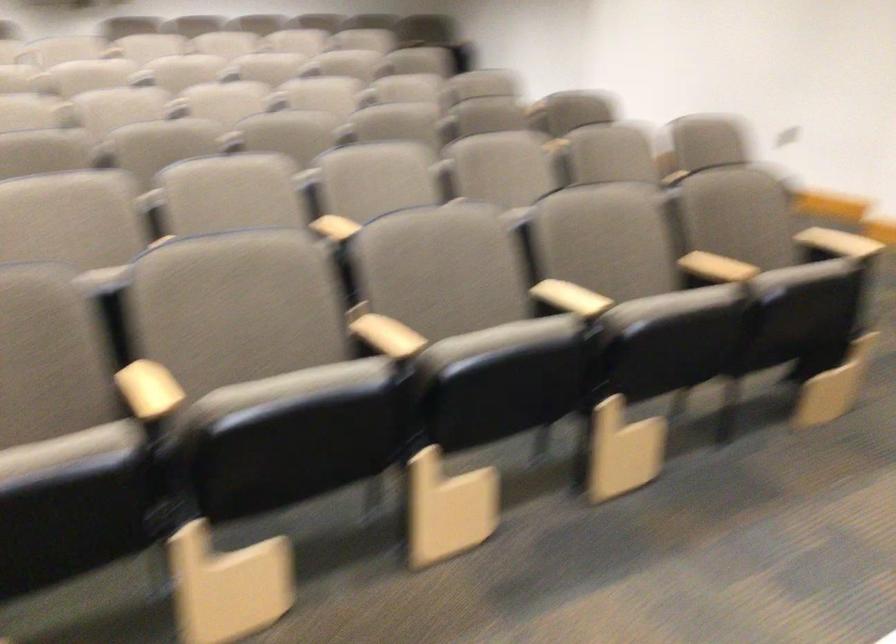
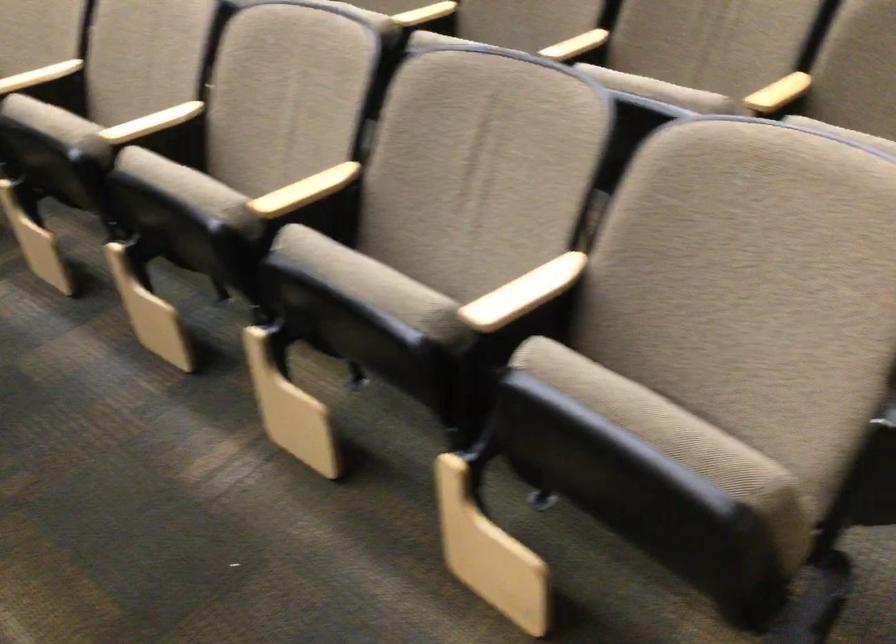
The point at (493, 185) is marked in the first image. Where is the corresponding point in the second image?

(151, 122)